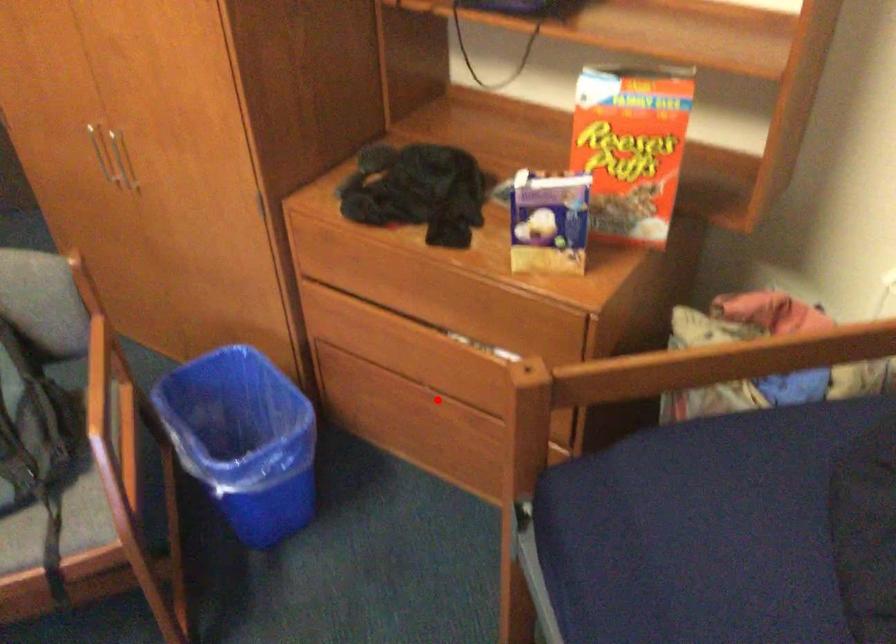
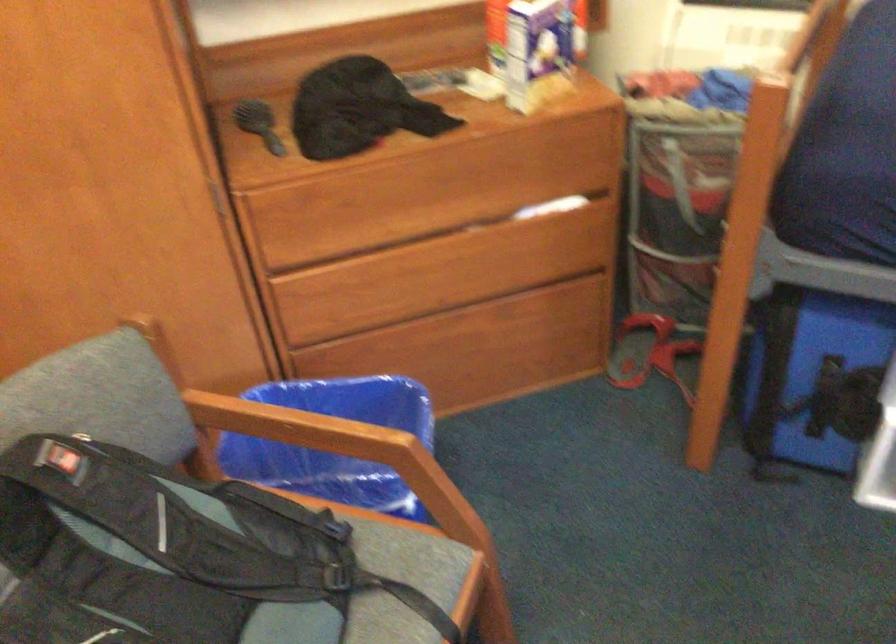
Where in the second image is the point corresponding to the highlighted location from the first image?

(453, 319)